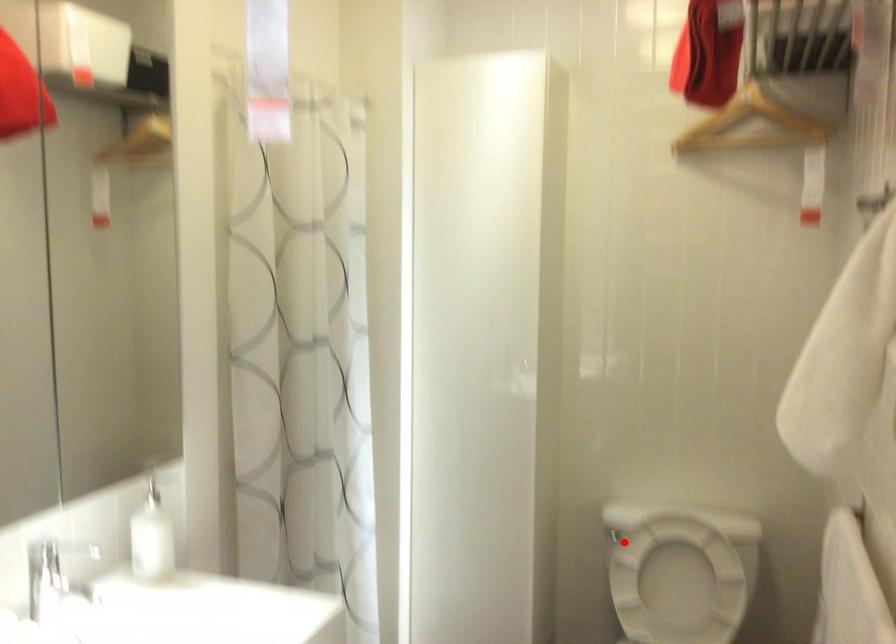
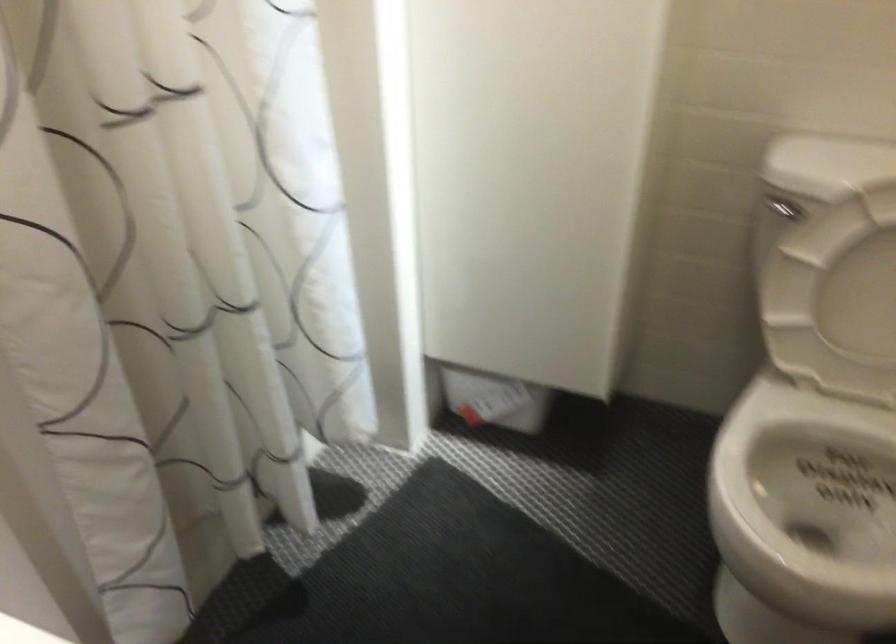
The point at the highlighted location is marked in the first image. Where is the corresponding point in the second image?

(782, 210)